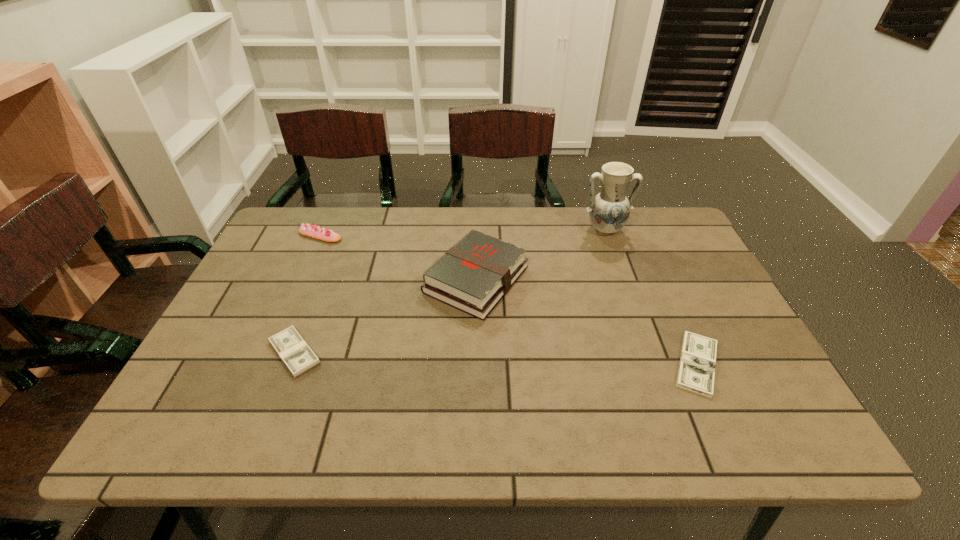
This screenshot has height=540, width=960. I want to click on free location at the far edge of the desktop, so click(347, 228).

In the image, there is a desktop. At what (x,y) coordinates should I click in order to perform the action: click on free space at the near edge. Please return your answer as a coordinate pair (x, y). Looking at the image, I should click on (348, 426).

Identify the location of free space at the left edge of the desktop. (314, 253).

The image size is (960, 540). I want to click on free space at the right edge, so click(753, 374).

The image size is (960, 540). In the image, there is a desktop. Find the location of `blank space at the far left corner`. blank space at the far left corner is located at coordinates (332, 212).

Image resolution: width=960 pixels, height=540 pixels. I want to click on vacant space at the near left corner, so click(x=235, y=419).

You are a GUI agent. You are given a task and a screenshot of the screen. Output one action in this format:
    pyautogui.click(x=<x>, y=<y>)
    Task: Click on the vacant space at the far right corner of the desktop
    The height and width of the screenshot is (540, 960).
    Given the screenshot: What is the action you would take?
    pyautogui.click(x=681, y=233)

You are a GUI agent. You are given a task and a screenshot of the screen. Output one action in this format:
    pyautogui.click(x=<x>, y=<y>)
    Task: Click on the blank space at the near right corner
    Image resolution: width=960 pixels, height=540 pixels.
    Given the screenshot: What is the action you would take?
    pyautogui.click(x=806, y=444)

The image size is (960, 540). I want to click on vacant space in between the right dollar and the third shortest object, so click(509, 300).

You are a GUI agent. You are given a task and a screenshot of the screen. Output one action in this format:
    pyautogui.click(x=<x>, y=<y>)
    Task: Click on the free space between the eclair and the pottery
    This screenshot has height=540, width=960.
    Given the screenshot: What is the action you would take?
    pyautogui.click(x=463, y=233)